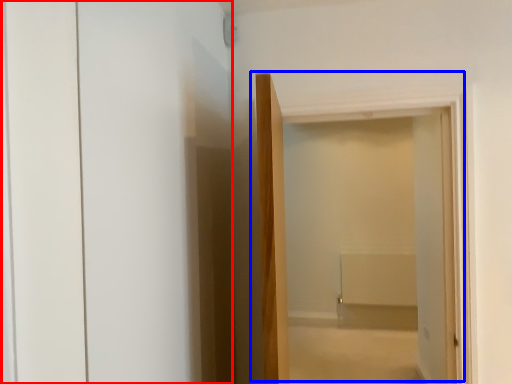
Question: Which point is further to the camera, screen door (highlighted by a red box) or door (highlighted by a blue box)?

Choices:
 (A) screen door
 (B) door

Answer: (B)